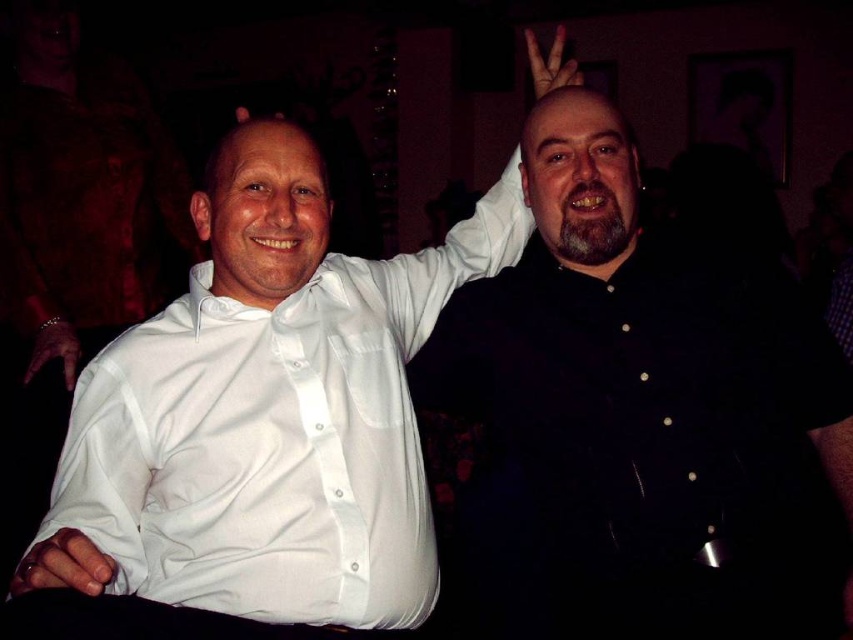
Can you confirm if matte white hand at lower left is thinner than metallic bracelet at lower left?

In fact, matte white hand at lower left might be wider than metallic bracelet at lower left.

Which of these two, matte white hand at lower left or metallic bracelet at lower left, stands taller?

With more height is metallic bracelet at lower left.

The height and width of the screenshot is (640, 853). Find the location of `matte white hand at lower left`. matte white hand at lower left is located at coordinates coord(62,564).

Who is taller, white glossy shirt at center or metallic bracelet at lower left?

white glossy shirt at center is taller.

Who is positioned more to the left, white glossy shirt at center or metallic bracelet at lower left?

From the viewer's perspective, metallic bracelet at lower left appears more on the left side.

This screenshot has height=640, width=853. I want to click on white glossy shirt at center, so click(271, 410).

Is point (698, 630) in front of point (61, 554)?

No, (698, 630) is behind (61, 554).

How far apart are black matte shirt at right and matte white hand at lower left?

33.29 inches

Who is more forward, (799, 456) or (20, 589)?

Point (20, 589) is in front.

Where is `black matte shirt at right`? The width and height of the screenshot is (853, 640). black matte shirt at right is located at coordinates (648, 412).